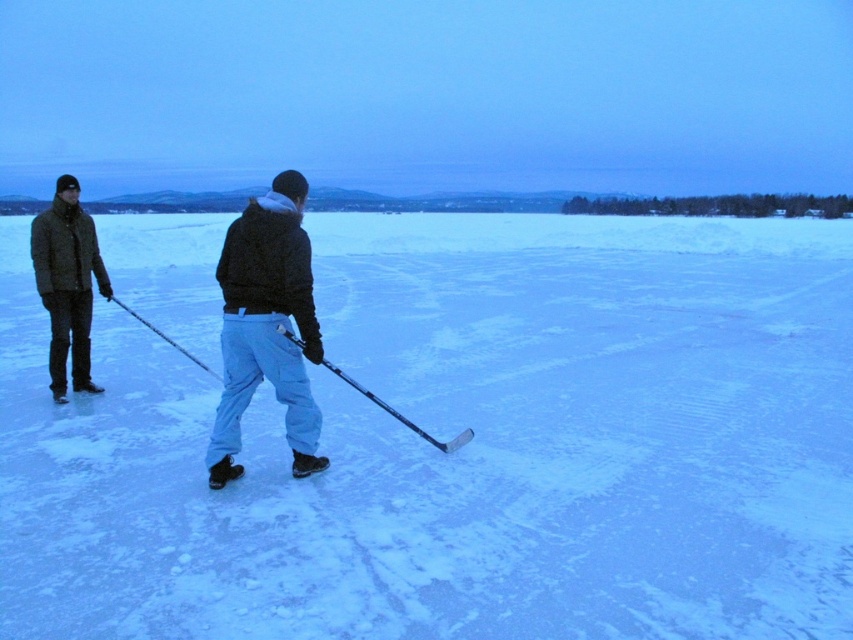
You are a photographer trying to capture the ice hockey scene. You want to position your camera at the center of the image to best frame the dark green jacket at left and the other player. Where should you place the camera horizontally to ensure both subjects are in the frame?

Place the camera horizontally slightly to the left of center to ensure both the dark green jacket at left and the other player are within the frame.

You are an ice hockey player trying to find the safest spot to plant your feet. The white matte snow at center is known to be more stable than other areas. Where should you position yourself to ensure stability?

The white matte snow at center is located at point [462,448], so you should position yourself there for stability.

You are an ice hockey player who needs to choose between the black matte jacket at center and the black glossy hockey stick at center to carry with you. Based on their sizes, which one is more suitable to carry?

The black matte jacket at center is larger than the black glossy hockey stick at center, so the hockey stick would be more suitable to carry as it is smaller and easier to handle.